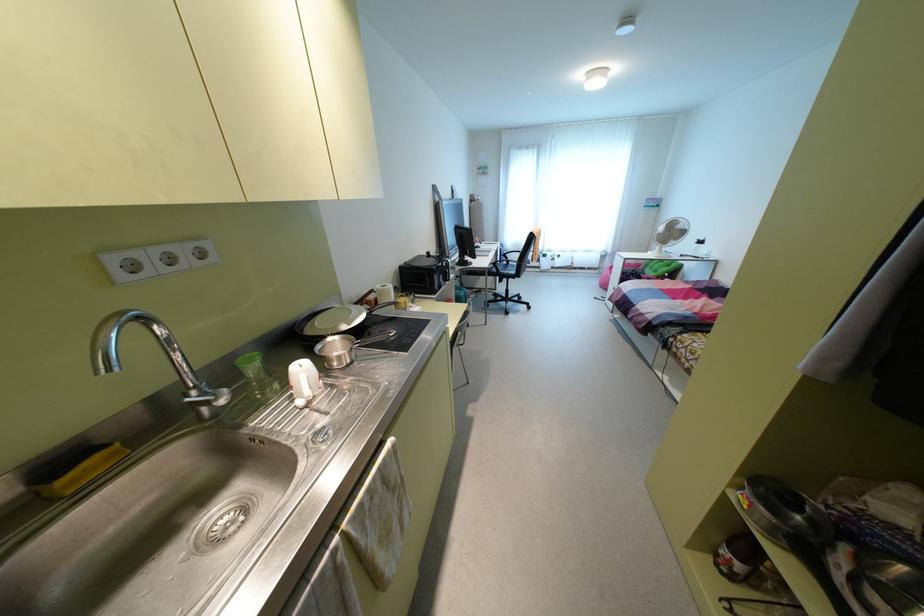
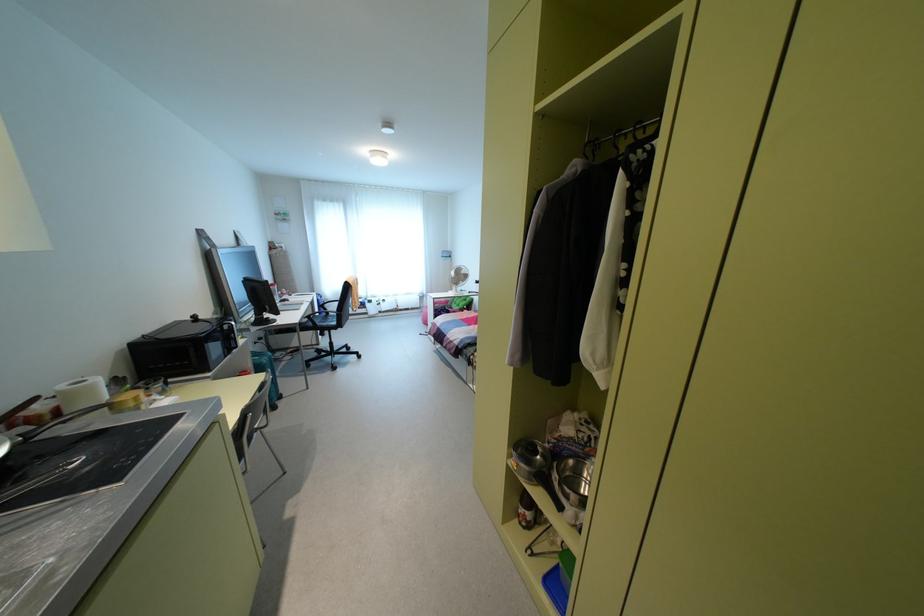
The point at (493, 262) is marked in the first image. Where is the corresponding point in the second image?

(309, 315)